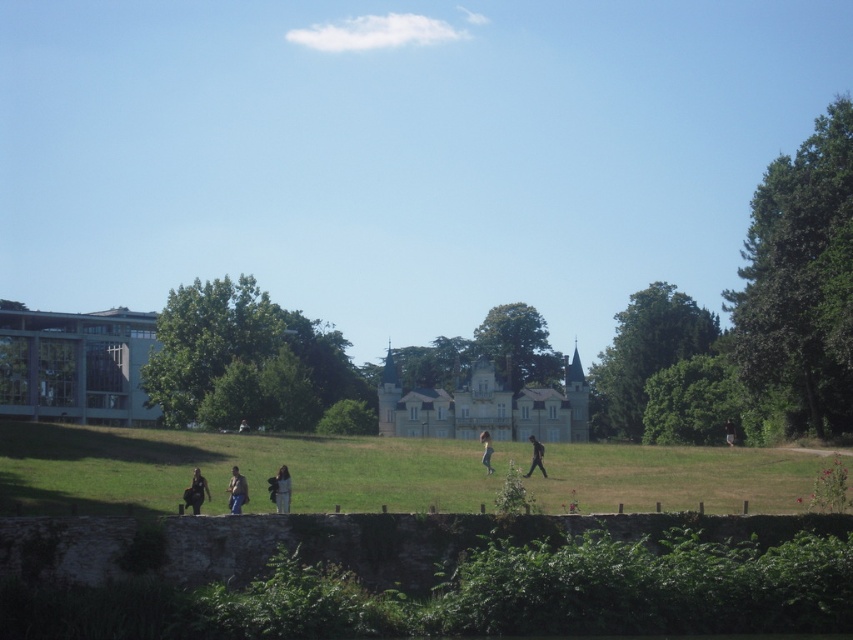
Question: Which object is the farthest from the dark brown leather jacket at center?

Choices:
 (A) light brown fabric pants at center
 (B) green grassy field at lower center
 (C) black fabric person at center

Answer: (A)

Question: Among these points, which one is farthest from the camera?

Choices:
 (A) (231, 468)
 (B) (779, 456)
 (C) (276, 499)

Answer: (B)

Question: Does dark brown leather jacket at lower left have a lesser width compared to light brown leather jacket at lower center?

Choices:
 (A) yes
 (B) no

Answer: (A)

Question: Based on their relative distances, which object is nearer to the black fabric person at center?

Choices:
 (A) light brown leather jacket at lower center
 (B) dark brown leather jacket at center
 (C) light brown fabric pants at center
 (D) dark brown leather jacket at lower left

Answer: (C)

Question: Is dark brown leather jacket at center in front of light brown fabric pants at center?

Choices:
 (A) yes
 (B) no

Answer: (A)

Question: Does dark brown leather jacket at lower left have a lesser width compared to black fabric person at center?

Choices:
 (A) no
 (B) yes

Answer: (B)